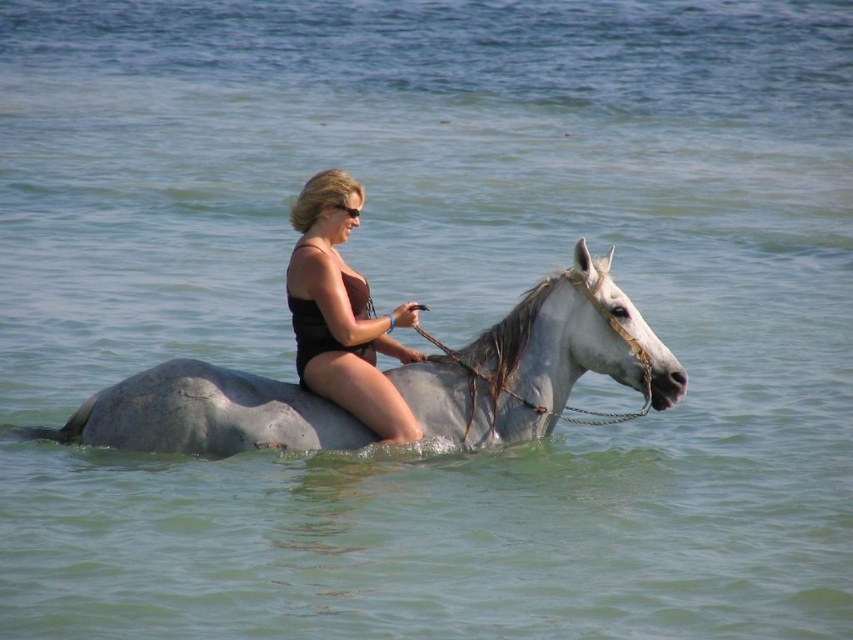
Which is behind, point (524, 388) or point (294, 248)?

The point (524, 388) is behind.

Does white glossy horse at center appear on the right side of black matte swimsuit at center?

Yes, white glossy horse at center is to the right of black matte swimsuit at center.

Does point (289, 424) come behind point (332, 394)?

No, it is not.

You are a GUI agent. You are given a task and a screenshot of the screen. Output one action in this format:
    pyautogui.click(x=<x>, y=<y>)
    Task: Click on the white glossy horse at center
    
    Given the screenshot: What is the action you would take?
    pyautogui.click(x=538, y=360)